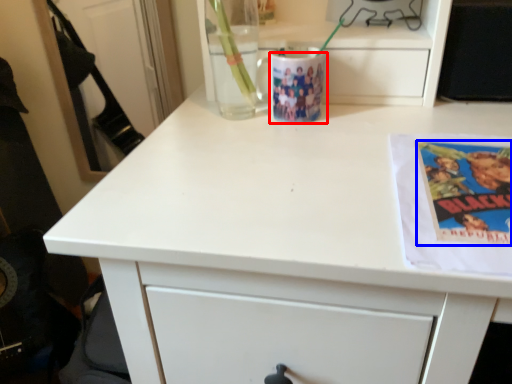
Question: Which object appears farthest to the camera in this image, mug (highlighted by a red box) or paperback book (highlighted by a blue box)?

Choices:
 (A) mug
 (B) paperback book

Answer: (A)